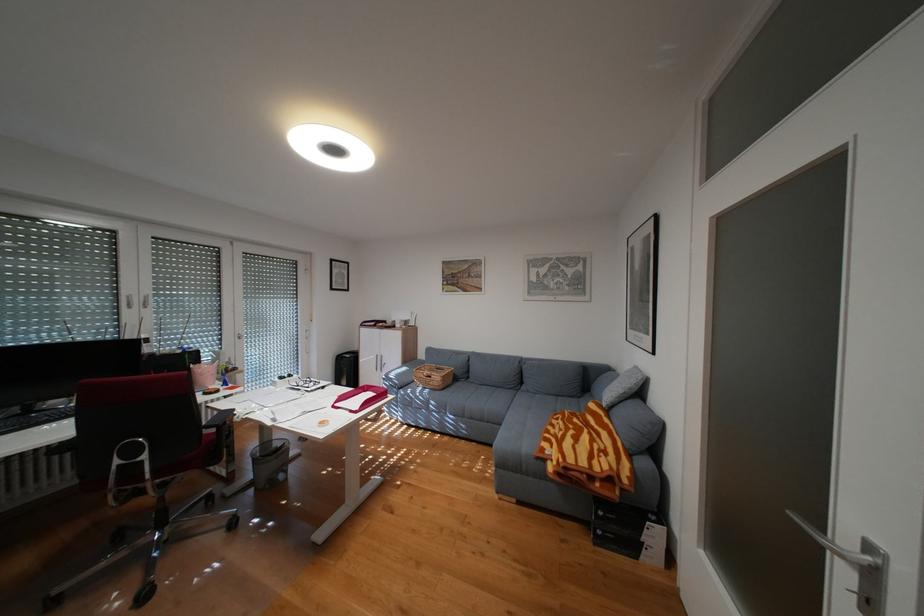
Image resolution: width=924 pixels, height=616 pixels. I want to click on black chair armrest, so coord(217,418).